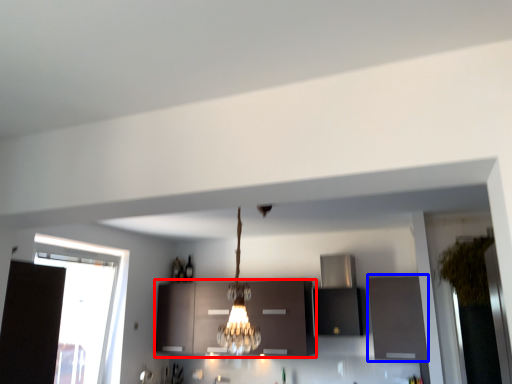
Question: Which object is closer to the camera taking this photo, cabinetry (highlighted by a red box) or cabinetry (highlighted by a blue box)?

Choices:
 (A) cabinetry
 (B) cabinetry

Answer: (B)